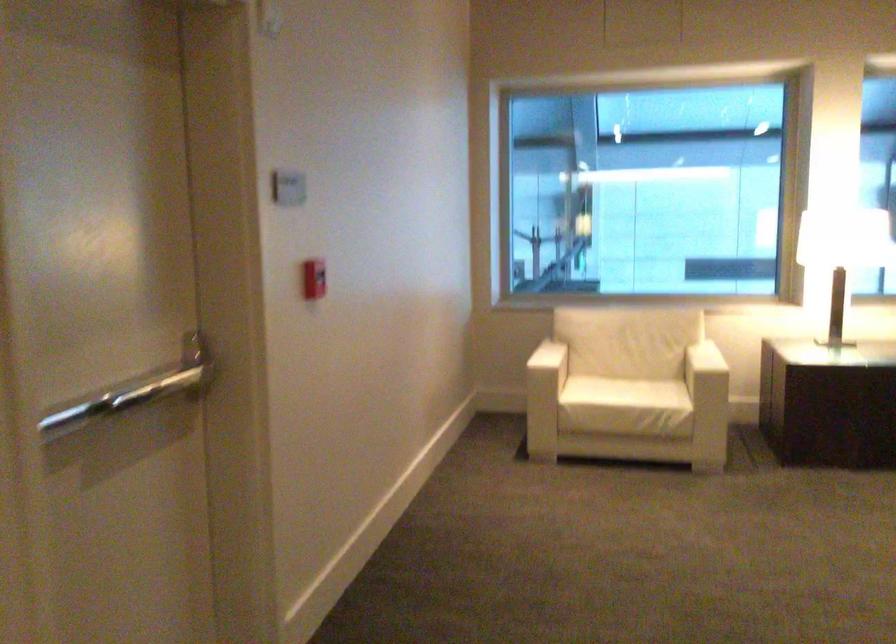
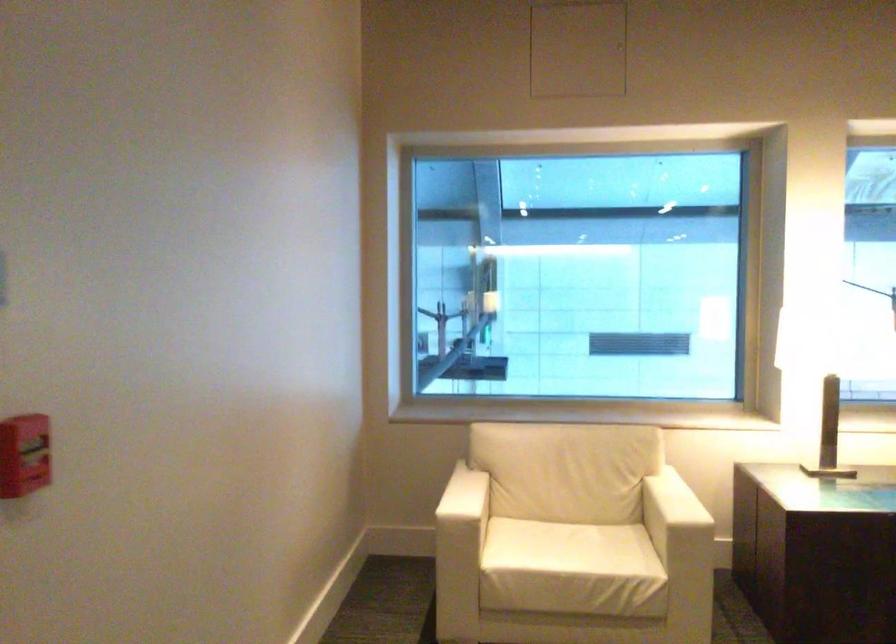
Question: What movement of the cameraman would produce the second image?

Choices:
 (A) Left
 (B) Right
 (C) Forward
 (D) Backward

Answer: (C)